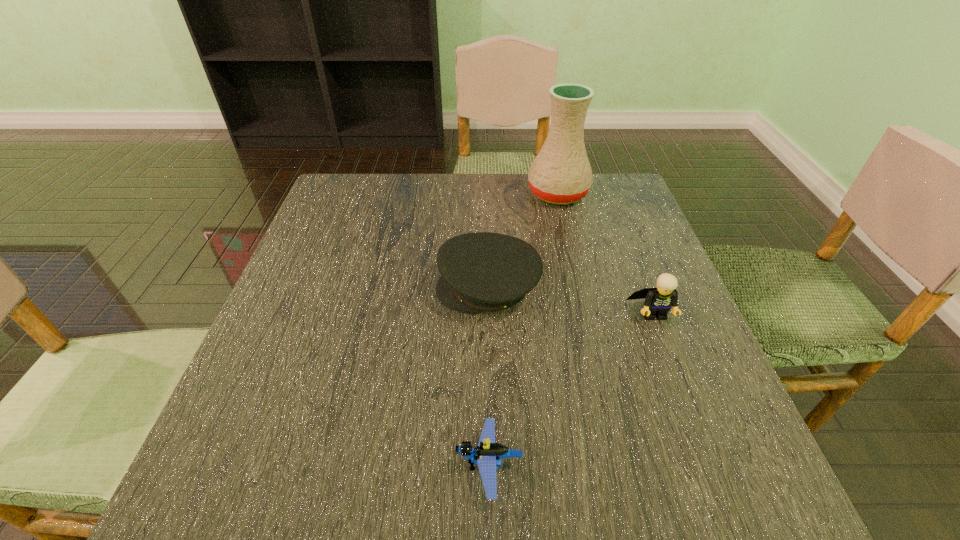
Identify the location of free space located on the front-facing side of the beret. (397, 288).

What are the coordinates of `free space located on the front-facing side of the beret` in the screenshot? It's located at (294, 288).

Identify the location of blank space located 0.360m on the front-facing side of the left Lego. The height and width of the screenshot is (540, 960). (214, 467).

Find the location of a particular element. The width and height of the screenshot is (960, 540). free space located 0.130m on the front-facing side of the left Lego is located at coordinates (369, 467).

I want to click on free space located 0.270m on the front-facing side of the left Lego, so click(275, 467).

The image size is (960, 540). I want to click on object at the far edge, so click(561, 174).

Image resolution: width=960 pixels, height=540 pixels. In order to click on object present at the near edge in this screenshot , I will do `click(488, 454)`.

You are a GUI agent. You are given a task and a screenshot of the screen. Output one action in this format:
    pyautogui.click(x=<x>, y=<y>)
    Task: Click on the pottery located at the right edge
    
    Given the screenshot: What is the action you would take?
    pyautogui.click(x=561, y=174)

Where is `Lego situated at the right edge`? This screenshot has width=960, height=540. Lego situated at the right edge is located at coordinates (x=659, y=300).

I want to click on object situated at the far right corner, so click(x=561, y=174).